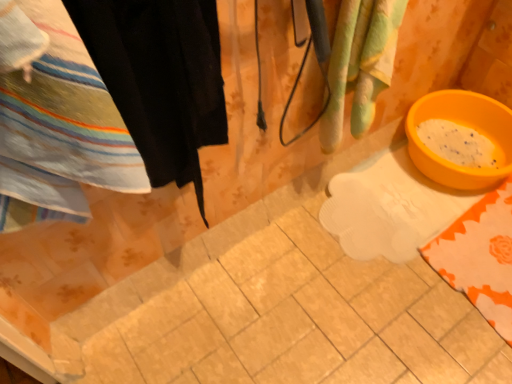
Question: From the image's perspective, is striped cotton towel at left above orange plastic basin at lower right?

Choices:
 (A) no
 (B) yes

Answer: (A)

Question: Is striped cotton towel at left outside of orange plastic basin at lower right?

Choices:
 (A) yes
 (B) no

Answer: (A)

Question: From the image's perspective, is striped cotton towel at left beneath orange plastic basin at lower right?

Choices:
 (A) yes
 (B) no

Answer: (A)

Question: Is there a large distance between striped cotton towel at left and orange plastic basin at lower right?

Choices:
 (A) yes
 (B) no

Answer: (A)

Question: From a real-world perspective, is striped cotton towel at left on orange plastic basin at lower right?

Choices:
 (A) no
 (B) yes

Answer: (B)

Question: Is point (105, 59) positioned closer to the camera than point (358, 97)?

Choices:
 (A) closer
 (B) farther

Answer: (A)

Question: Is black fabric at left wider or thinner than green striped towel at upper right?

Choices:
 (A) wide
 (B) thin

Answer: (B)

Question: Is black fabric at left inside or outside of green striped towel at upper right?

Choices:
 (A) outside
 (B) inside

Answer: (A)

Question: In the image, is black fabric at left positioned in front of or behind green striped towel at upper right?

Choices:
 (A) behind
 (B) front

Answer: (B)

Question: Considering their positions, is green striped towel at upper right located in front of or behind striped cotton towel at left?

Choices:
 (A) front
 (B) behind

Answer: (B)

Question: Is green striped towel at upper right wider or thinner than striped cotton towel at left?

Choices:
 (A) thin
 (B) wide

Answer: (A)

Question: Is green striped towel at upper right taller or shorter than striped cotton towel at left?

Choices:
 (A) tall
 (B) short

Answer: (A)

Question: Looking at the image, does green striped towel at upper right seem bigger or smaller compared to striped cotton towel at left?

Choices:
 (A) small
 (B) big

Answer: (A)

Question: From a real-world perspective, is orange plastic basin at lower right positioned above or below green striped towel at upper right?

Choices:
 (A) below
 (B) above

Answer: (A)

Question: Considering their positions, is orange plastic basin at lower right located in front of or behind green striped towel at upper right?

Choices:
 (A) behind
 (B) front

Answer: (A)